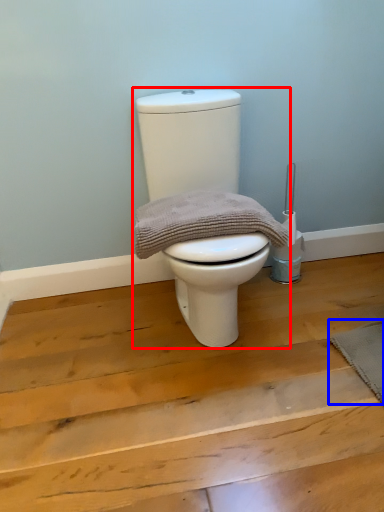
Question: Which object appears closest to the camera in this image, toilet (highlighted by a red box) or doormat (highlighted by a blue box)?

Choices:
 (A) toilet
 (B) doormat

Answer: (A)